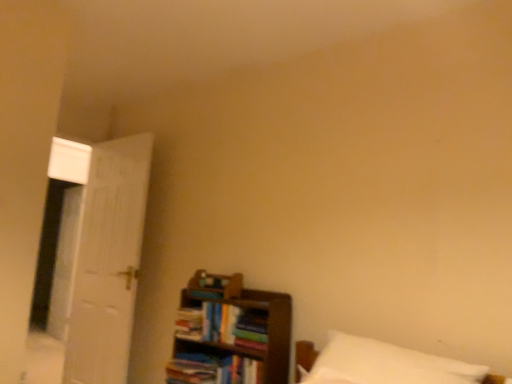
Identify the location of hardcover book at center, positioned as the fourth book in bottom-to-top order. (205, 294).

Where is `hardcover book at center, the 2th book positioned from the bottom`? This screenshot has height=384, width=512. hardcover book at center, the 2th book positioned from the bottom is located at coordinates tap(189, 323).

Locate an element on the screen. Image resolution: width=512 pixels, height=384 pixels. white matte door at left is located at coordinates (106, 261).

Locate an element on the screen. The height and width of the screenshot is (384, 512). white soft pillow at lower right is located at coordinates (385, 364).

Considering the relative sizes of hardcover book at center, which appears as the third book when viewed from the top, and wooden bookshelf at lower right in the image provided, is hardcover book at center, which appears as the third book when viewed from the top, taller than wooden bookshelf at lower right?

Incorrect, the height of hardcover book at center, which appears as the third book when viewed from the top, is not larger of that of wooden bookshelf at lower right.

From the image's perspective, between hardcover book at center, which appears as the third book when viewed from the top, and wooden bookshelf at lower right, which one is located above?

From the image's view, hardcover book at center, which appears as the third book when viewed from the top, is above.

Considering the points (189, 311) and (234, 364), which point is in front, point (189, 311) or point (234, 364)?

Point (234, 364)

Between hardcover book at center, the 2th book positioned from the bottom, and wooden bookshelf at lower right, which one appears on the right side from the viewer's perspective?

wooden bookshelf at lower right is more to the right.

Where is `pillow in front of the hardcover book at center, which appears as the third book when viewed from the top`? This screenshot has height=384, width=512. pillow in front of the hardcover book at center, which appears as the third book when viewed from the top is located at coordinates (385, 364).

Considering the relative sizes of hardcover book at center, which appears as the third book when viewed from the top, and white soft pillow at lower right in the image provided, is hardcover book at center, which appears as the third book when viewed from the top, wider than white soft pillow at lower right?

No, hardcover book at center, which appears as the third book when viewed from the top, is not wider than white soft pillow at lower right.

From the image's perspective, is hardcover book at center, the 2th book positioned from the bottom, beneath white soft pillow at lower right?

Yes.

Between hardcover book at center, the 2th book positioned from the bottom, and white soft pillow at lower right, which one appears on the left side from the viewer's perspective?

hardcover book at center, the 2th book positioned from the bottom, is more to the left.

Between wooden bookshelf at lower right and multicolored paper book at center, arranged as the 2th book when viewed from the top, which one has smaller size?

Smaller between the two is multicolored paper book at center, arranged as the 2th book when viewed from the top.

Considering the relative sizes of wooden bookshelf at lower right and multicolored paper book at center, arranged as the 2th book when viewed from the top, in the image provided, is wooden bookshelf at lower right thinner than multicolored paper book at center, arranged as the 2th book when viewed from the top,?

No.

Who is taller, wooden bookshelf at lower right or multicolored paper book at center, arranged as the 2th book when viewed from the top?

wooden bookshelf at lower right.

Is wooden bookshelf at lower right located outside multicolored paper book at center, arranged as the 2th book when viewed from the top?

Yes, wooden bookshelf at lower right is not within multicolored paper book at center, arranged as the 2th book when viewed from the top.

Is wooden bookshelf at lower right touching hardcover book at center, acting as the first book starting from the top?

There is a gap between wooden bookshelf at lower right and hardcover book at center, acting as the first book starting from the top.

From a real-world perspective, is wooden bookshelf at lower right above or below hardcover book at center, positioned as the fourth book in bottom-to-top order?

From a real-world perspective, wooden bookshelf at lower right is physically below hardcover book at center, positioned as the fourth book in bottom-to-top order.

Image resolution: width=512 pixels, height=384 pixels. I want to click on shelf below the hardcover book at center, acting as the first book starting from the top (from a real-world perspective), so click(x=231, y=335).

Is wooden bookshelf at lower right taller than hardcover book at center, positioned as the fourth book in bottom-to-top order?

Yes.

What's the angular difference between white soft pillow at lower right and hardcover book at center, which appears as the third book when viewed from the top,'s facing directions?

They differ by 2.26 degrees in their facing directions.

Choose the correct answer: Is white soft pillow at lower right inside hardcover book at center, which appears as the third book when viewed from the top, or outside it?

white soft pillow at lower right is outside hardcover book at center, which appears as the third book when viewed from the top.

From the white soft pillow at lower right, count 3rd books backward and point to it. Please provide its 2D coordinates.

[(189, 323)]

Can you confirm if white soft pillow at lower right is shorter than hardcover book at center, the 2th book positioned from the bottom?

Incorrect, the height of white soft pillow at lower right does not fall short of that of hardcover book at center, the 2th book positioned from the bottom.

Can you confirm if white matte door at left is thinner than hardcover book at center, positioned as the fourth book in bottom-to-top order?

Yes, white matte door at left is thinner than hardcover book at center, positioned as the fourth book in bottom-to-top order.

Does white matte door at left lie behind hardcover book at center, acting as the first book starting from the top?

Yes, white matte door at left is further from the camera.

Who is smaller, white matte door at left or hardcover book at center, acting as the first book starting from the top?

hardcover book at center, acting as the first book starting from the top, is smaller.

Can you tell me how much white matte door at left and hardcover book at center, positioned as the fourth book in bottom-to-top order, differ in facing direction?

1.13 degrees separate the facing orientations of white matte door at left and hardcover book at center, positioned as the fourth book in bottom-to-top order.

In terms of size, does wooden bookshelf at lower right appear bigger or smaller than white matte door at left?

In the image, wooden bookshelf at lower right appears to be smaller than white matte door at left.

Is white matte door at left at the back of wooden bookshelf at lower right?

wooden bookshelf at lower right is not turned away from white matte door at left.

Is there a large distance between wooden bookshelf at lower right and white matte door at left?

No, wooden bookshelf at lower right is not far away from white matte door at left.

From a real-world perspective, which object rests below the other?

In real-world perspective, wooden bookshelf at lower right is lower.

Locate an element on the screen. The image size is (512, 384). shelf to the right of hardcover book at center, the 2th book positioned from the bottom is located at coordinates (231, 335).

Locate an element on the screen. This screenshot has width=512, height=384. pillow that appears below the hardcover book at center, the 2th book positioned from the bottom (from a real-world perspective) is located at coordinates (385, 364).

When comparing their distances from white matte door at left, does wooden bookshelf at lower right or hardcover book at center, the 2th book positioned from the bottom, seem closer?

wooden bookshelf at lower right is closer to white matte door at left.

From the image, which object appears to be farther from wooden bookshelf at lower right, multicolored paper book at center, arranged as the 2th book when viewed from the top, or hardcover book at center, acting as the first book starting from the top?

hardcover book at center, acting as the first book starting from the top.

From the image, which object appears to be nearer to white matte door at left, white soft pillow at lower right or hardcover book at center, acting as the first book starting from the top?

Among the two, hardcover book at center, acting as the first book starting from the top, is located nearer to white matte door at left.

When comparing their distances from white matte door at left, does white soft pillow at lower right or hardcover book at center, the 4th book positioned from the top, seem further?

Among the two, white soft pillow at lower right is located further to white matte door at left.

From the image, which object appears to be nearer to hardcover book at center, which appears as the third book when viewed from the top, multicolored paper book at center, which is the third book from bottom to top, or white matte door at left?

Based on the image, multicolored paper book at center, which is the third book from bottom to top, appears to be nearer to hardcover book at center, which appears as the third book when viewed from the top.

Estimate the real-world distances between objects in this image. Which object is further from wooden bookshelf at lower right, white soft pillow at lower right or hardcover book at center, acting as the first book starting from the top?

white soft pillow at lower right lies further to wooden bookshelf at lower right than the other object.

In the scene shown: Considering their positions, is hardcover book at center, which appears as the third book when viewed from the top, positioned further to hardcover book at center, acting as the first book starting from the top, than hardcover book at center, the 4th book positioned from the top?

Among the two, hardcover book at center, the 4th book positioned from the top, is located further to hardcover book at center, acting as the first book starting from the top.

When comparing their distances from wooden bookshelf at lower right, does hardcover book at center, the 2th book positioned from the bottom, or hardcover book at center, the 4th book positioned from the top, seem closer?

Among the two, hardcover book at center, the 4th book positioned from the top, is located nearer to wooden bookshelf at lower right.

Find the location of a particular element. The image size is (512, 384). shelf situated between hardcover book at center, the 2th book positioned from the bottom, and multicolored paper book at center, which is the third book from bottom to top, from left to right is located at coordinates (231, 335).

Image resolution: width=512 pixels, height=384 pixels. Find the location of `shelf located between white soft pillow at lower right and multicolored paper book at center, which is the third book from bottom to top, in the depth direction`. shelf located between white soft pillow at lower right and multicolored paper book at center, which is the third book from bottom to top, in the depth direction is located at coordinates (231, 335).

At what (x,y) coordinates should I click in order to perform the action: click on shelf between white soft pillow at lower right and hardcover book at center, positioned as the fourth book in bottom-to-top order, along the z-axis. Please return your answer as a coordinate pair (x, y). Image resolution: width=512 pixels, height=384 pixels. Looking at the image, I should click on (231, 335).

Locate an element on the screen. Image resolution: width=512 pixels, height=384 pixels. shelf between white matte door at left and multicolored paper book at center, which is the third book from bottom to top, from left to right is located at coordinates (231, 335).